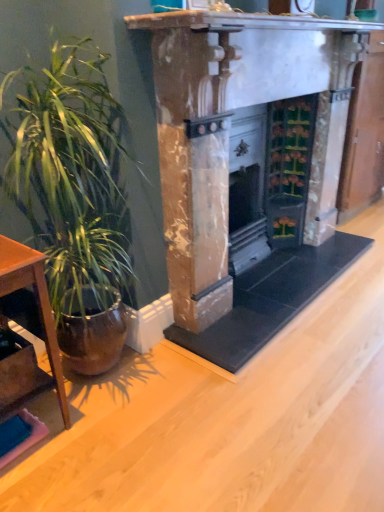
Locate an element on the screen. The width and height of the screenshot is (384, 512). free spot to the right of brown wooden table at left is located at coordinates tap(97, 424).